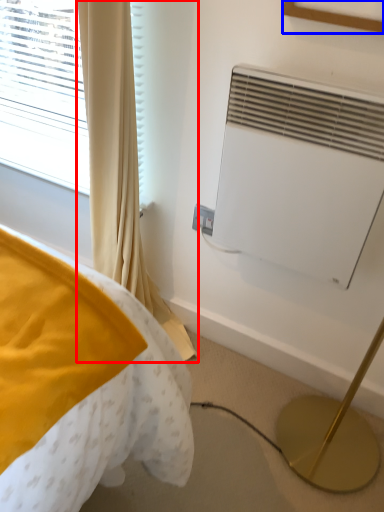
Question: Among these objects, which one is nearest to the camera, curtain (highlighted by a red box) or picture frame (highlighted by a blue box)?

Choices:
 (A) curtain
 (B) picture frame

Answer: (B)